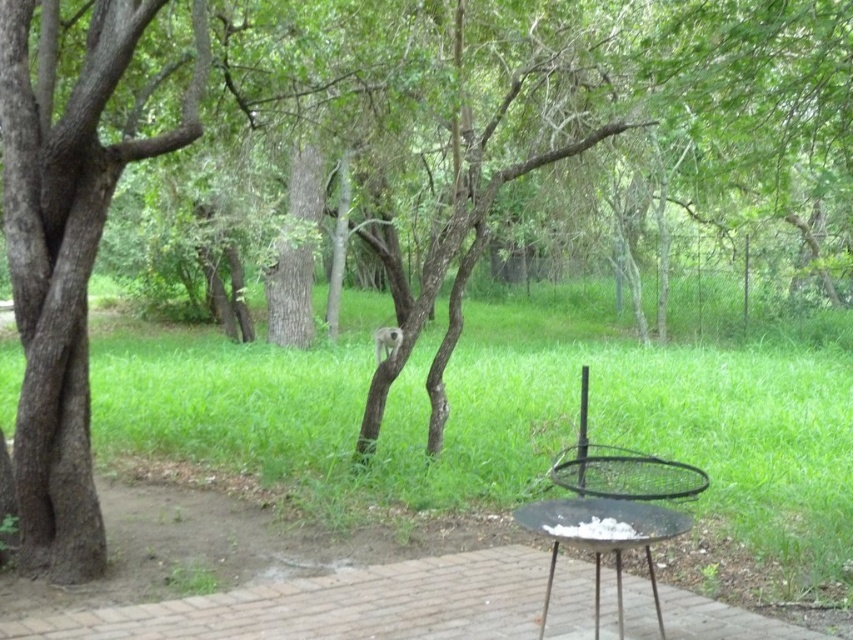
Does green grass at center have a larger size compared to smooth brown tree trunk at left?

Indeed, green grass at center has a larger size compared to smooth brown tree trunk at left.

Which is below, green grass at center or smooth brown tree trunk at left?

green grass at center

Describe the element at coordinates (503, 420) in the screenshot. I see `green grass at center` at that location.

Find the location of a particular element. Image resolution: width=853 pixels, height=640 pixels. green grass at center is located at coordinates pos(503,420).

You are a GUI agent. You are given a task and a screenshot of the screen. Output one action in this format:
    pyautogui.click(x=<x>, y=<y>)
    Task: Click on the smooth brown tree trunk at left
    
    Given the screenshot: What is the action you would take?
    pyautogui.click(x=65, y=262)

Who is higher up, smooth brown tree trunk at left or black metal grill at lower right?

smooth brown tree trunk at left is higher up.

Identify the location of smooth brown tree trunk at left. (65, 262).

Does green grass at center appear on the left side of black metal grill at lower right?

Correct, you'll find green grass at center to the left of black metal grill at lower right.

From the picture: Which of these two, green grass at center or black metal grill at lower right, stands shorter?

Standing shorter between the two is black metal grill at lower right.

Is point (560, 352) in front of point (576, 499)?

That is False.

Where is `green grass at center`? This screenshot has width=853, height=640. green grass at center is located at coordinates (503, 420).